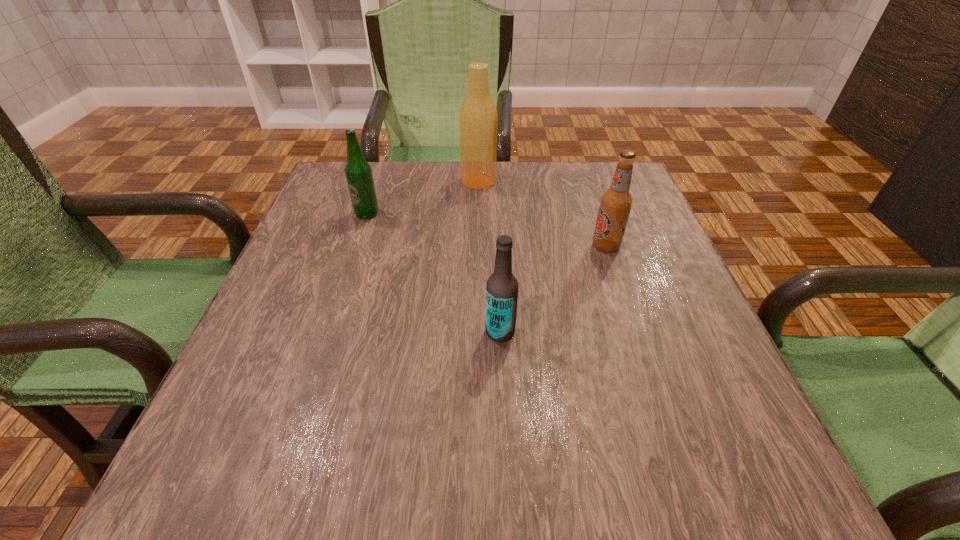
I want to click on empty space that is in between the tallest object and the second nearest beer bottle, so click(542, 213).

Identify the location of free space that is in between the nearest beer bottle and the third farthest beer bottle. This screenshot has height=540, width=960. (553, 289).

I want to click on free area in between the nearest object and the farthest beer bottle, so click(x=490, y=256).

You are a GUI agent. You are given a task and a screenshot of the screen. Output one action in this format:
    pyautogui.click(x=<x>, y=<y>)
    Task: Click on the free area in between the farthest object and the nearest object
    The height and width of the screenshot is (540, 960).
    Given the screenshot: What is the action you would take?
    pyautogui.click(x=490, y=256)

In order to click on the second closest object relative to the tallest object in this screenshot , I will do `click(616, 202)`.

This screenshot has width=960, height=540. In order to click on object that ranks as the third closest to the farthest beer bottle in this screenshot , I will do `click(502, 286)`.

Point out which beer bottle is positioned as the third nearest to the farthest beer bottle. Please provide its 2D coordinates. Your answer should be formatted as a tuple, i.e. [(x, y)], where the tuple contains the x and y coordinates of a point satisfying the conditions above.

[(502, 286)]

Identify the location of beer bottle that is the second nearest to the leftmost object. pos(502,286).